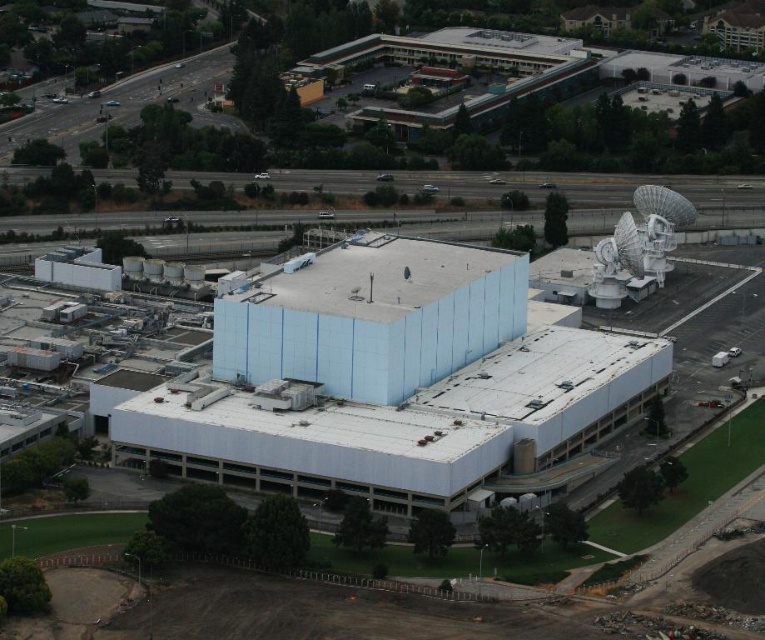
Based on the photo, does white matte building at center appear over white metallic satellite at upper right?

No.

At what (x,y) coordinates should I click in order to perform the action: click on white matte building at center. Please return your answer as a coordinate pair (x, y). The image size is (765, 640). Looking at the image, I should click on (391, 380).

Find the location of `white matte building at center`. white matte building at center is located at coordinates (391, 380).

The image size is (765, 640). Find the location of `white matte building at center`. white matte building at center is located at coordinates 391,380.